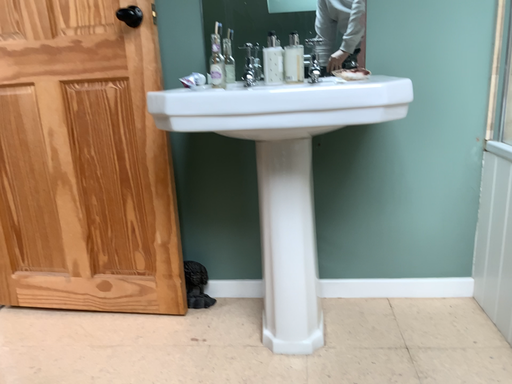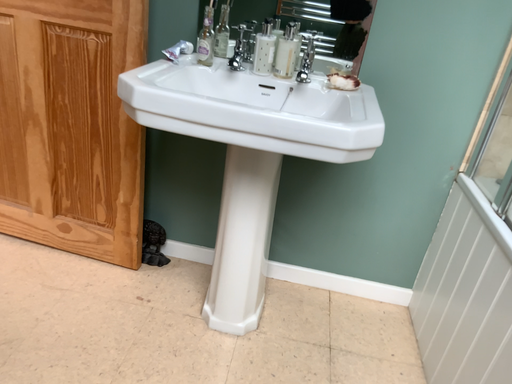
Question: How did the camera likely rotate when shooting the video?

Choices:
 (A) rotated downward
 (B) rotated upward

Answer: (A)